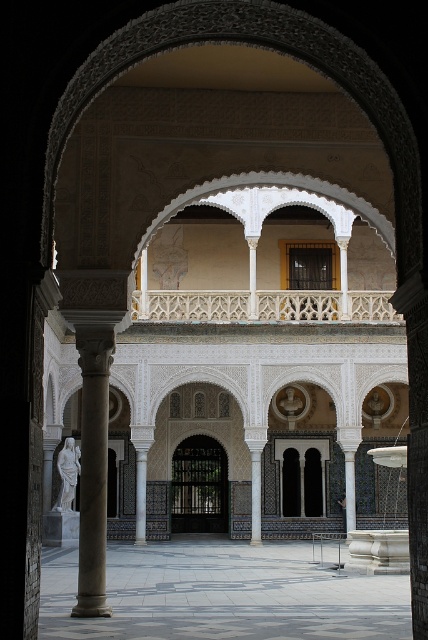
Who is taller, polished stone column at left or white marble column at center?

Standing taller between the two is polished stone column at left.

Does polished stone column at left have a lesser height compared to white marble column at center?

Incorrect, polished stone column at left's height does not fall short of white marble column at center's.

Is point (83, 385) in front of point (145, 461)?

That is True.

Where is `polished stone column at left`? The width and height of the screenshot is (428, 640). polished stone column at left is located at coordinates (92, 467).

Between point (293, 632) and point (62, 460), which one is positioned in front?

Positioned in front is point (293, 632).

Can you confirm if polished stone floor at center is taller than white marble statue at left?

Yes, polished stone floor at center is taller than white marble statue at left.

The height and width of the screenshot is (640, 428). I want to click on polished stone floor at center, so click(222, 595).

Does polished stone column at left have a larger size compared to white marble statue at left?

Indeed, polished stone column at left has a larger size compared to white marble statue at left.

This screenshot has width=428, height=640. Identify the location of polished stone column at left. (92, 467).

The width and height of the screenshot is (428, 640). Find the location of `polished stone column at left`. polished stone column at left is located at coordinates (92, 467).